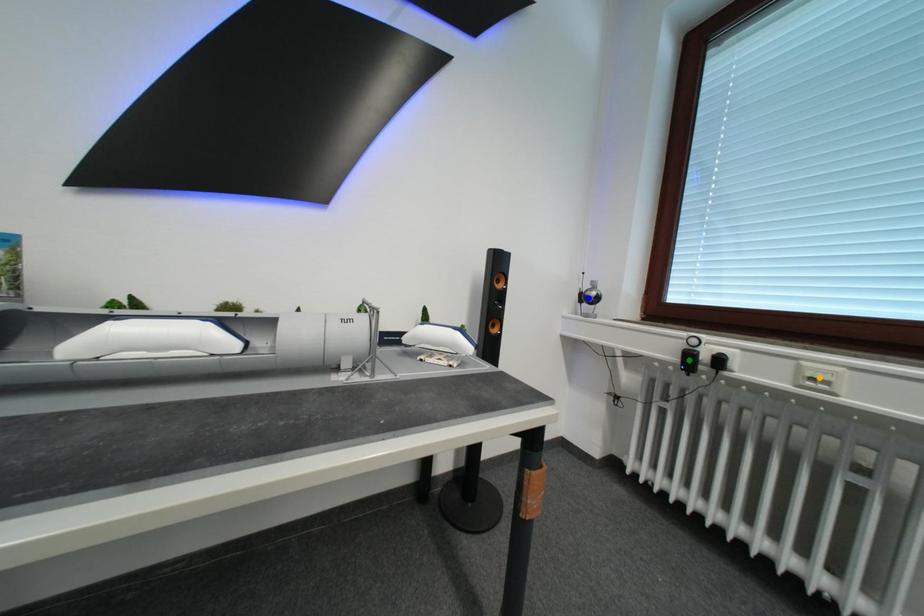
Looking at this image, order these from nearest to farthest:
- green point
- blue point
- orange point

orange point, green point, blue point